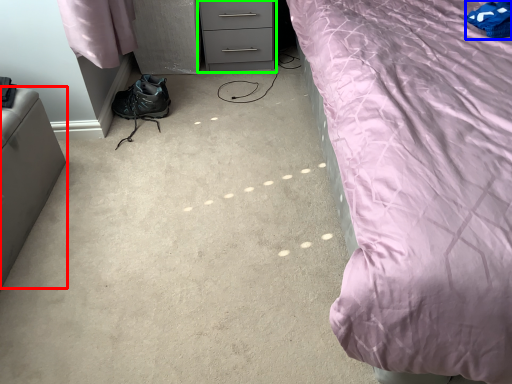
Question: Which object is the closest to the furniture (highlighted by a red box)? Choose among these: pillow (highlighted by a blue box) or chest of drawers (highlighted by a green box).

Choices:
 (A) pillow
 (B) chest of drawers

Answer: (B)